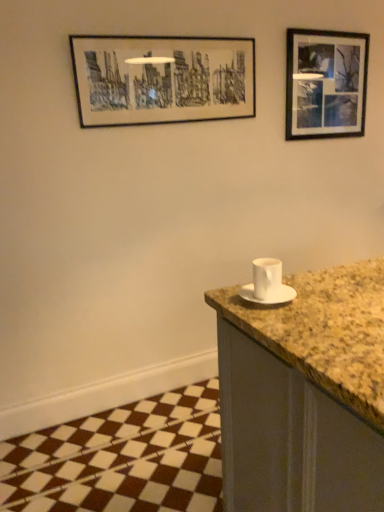
Question: From the image's perspective, would you say black matte picture frame at upper center, which is the first picture frame in left-to-right order, is shown under white ceramic cup at right?

Choices:
 (A) yes
 (B) no

Answer: (B)

Question: Does black matte picture frame at upper center, which is the 1th picture frame from front to back, turn towards white ceramic cup at right?

Choices:
 (A) yes
 (B) no

Answer: (B)

Question: Is black matte picture frame at upper center, which is the first picture frame in left-to-right order, wider than white ceramic cup at right?

Choices:
 (A) yes
 (B) no

Answer: (B)

Question: Does black matte picture frame at upper center, acting as the 2th picture frame starting from the back, have a lesser height compared to white ceramic cup at right?

Choices:
 (A) yes
 (B) no

Answer: (B)

Question: Considering the relative positions of black matte picture frame at upper center, which is the first picture frame in left-to-right order, and white ceramic cup at right in the image provided, is black matte picture frame at upper center, which is the first picture frame in left-to-right order, to the right of white ceramic cup at right from the viewer's perspective?

Choices:
 (A) yes
 (B) no

Answer: (B)

Question: From a real-world perspective, is black matte picture frame at upper right, marked as the first picture frame in a right-to-left arrangement, above or below white ceramic cup at right?

Choices:
 (A) above
 (B) below

Answer: (A)

Question: Is point (329, 56) closer or farther from the camera than point (261, 261)?

Choices:
 (A) closer
 (B) farther

Answer: (B)

Question: In the image, is black matte picture frame at upper right, the 2th picture frame positioned from the left, positioned in front of or behind white ceramic cup at right?

Choices:
 (A) front
 (B) behind

Answer: (B)

Question: Considering the positions of black matte picture frame at upper right, arranged as the 2th picture frame when viewed from the front, and white ceramic cup at right in the image, is black matte picture frame at upper right, arranged as the 2th picture frame when viewed from the front, taller or shorter than white ceramic cup at right?

Choices:
 (A) short
 (B) tall

Answer: (B)

Question: Is white ceramic cup at right to the left or to the right of black matte picture frame at upper center, which is the first picture frame in left-to-right order, in the image?

Choices:
 (A) left
 (B) right

Answer: (B)

Question: In the image, is white ceramic cup at right positioned in front of or behind black matte picture frame at upper center, which is the 1th picture frame from front to back?

Choices:
 (A) behind
 (B) front

Answer: (B)

Question: Is white ceramic cup at right inside the boundaries of black matte picture frame at upper center, acting as the 2th picture frame starting from the back, or outside?

Choices:
 (A) inside
 (B) outside

Answer: (B)

Question: From their relative heights in the image, would you say white ceramic cup at right is taller or shorter than black matte picture frame at upper center, which is the 1th picture frame from front to back?

Choices:
 (A) tall
 (B) short

Answer: (B)

Question: Is black matte picture frame at upper right, the 2th picture frame positioned from the left, inside the boundaries of white matte saucer at right, or outside?

Choices:
 (A) outside
 (B) inside

Answer: (A)

Question: Considering the positions of black matte picture frame at upper right, marked as the first picture frame in a right-to-left arrangement, and white matte saucer at right in the image, is black matte picture frame at upper right, marked as the first picture frame in a right-to-left arrangement, bigger or smaller than white matte saucer at right?

Choices:
 (A) small
 (B) big

Answer: (B)